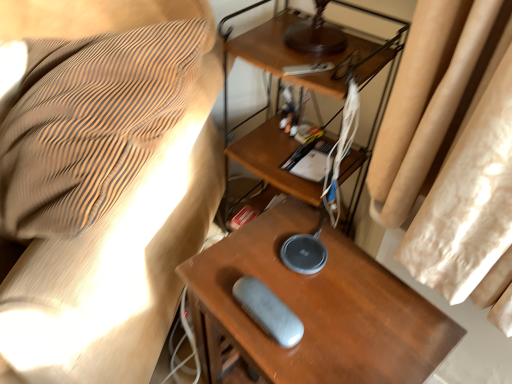
Question: Is gray fabric pouch at lower center aimed at wooden table at center?

Choices:
 (A) yes
 (B) no

Answer: (B)

Question: Considering the relative sizes of gray fabric pouch at lower center and wooden table at center in the image provided, is gray fabric pouch at lower center bigger than wooden table at center?

Choices:
 (A) yes
 (B) no

Answer: (A)

Question: Is gray fabric pouch at lower center to the left of wooden table at center from the viewer's perspective?

Choices:
 (A) yes
 (B) no

Answer: (A)

Question: Is gray fabric pouch at lower center shorter than wooden table at center?

Choices:
 (A) yes
 (B) no

Answer: (A)

Question: Is gray fabric pouch at lower center touching wooden table at center?

Choices:
 (A) yes
 (B) no

Answer: (B)

Question: Would you say woodendesk at center is to the left or to the right of gray fabric pouch at lower center in the picture?

Choices:
 (A) left
 (B) right

Answer: (B)

Question: Is woodendesk at center in front of or behind gray fabric pouch at lower center in the image?

Choices:
 (A) front
 (B) behind

Answer: (B)

Question: Does point (240, 157) appear closer or farther from the camera than point (29, 1)?

Choices:
 (A) closer
 (B) farther

Answer: (B)

Question: From a real-world perspective, is woodendesk at center physically located above or below gray fabric pouch at lower center?

Choices:
 (A) above
 (B) below

Answer: (B)

Question: Considering the positions of point (173, 297) and point (300, 344), is point (173, 297) closer or farther from the camera than point (300, 344)?

Choices:
 (A) farther
 (B) closer

Answer: (A)

Question: Considering their positions, is gray fabric pouch at lower center located in front of or behind wooden table at center?

Choices:
 (A) front
 (B) behind

Answer: (A)

Question: From a real-world perspective, is gray fabric pouch at lower center positioned above or below wooden table at center?

Choices:
 (A) above
 (B) below

Answer: (A)

Question: Considering the positions of gray fabric pouch at lower center and wooden table at center in the image, is gray fabric pouch at lower center taller or shorter than wooden table at center?

Choices:
 (A) short
 (B) tall

Answer: (A)

Question: Relative to woodendesk at center, is gray fabric pouch at lower center in front or behind?

Choices:
 (A) behind
 (B) front

Answer: (B)

Question: Is point (141, 288) closer or farther from the camera than point (230, 152)?

Choices:
 (A) closer
 (B) farther

Answer: (A)